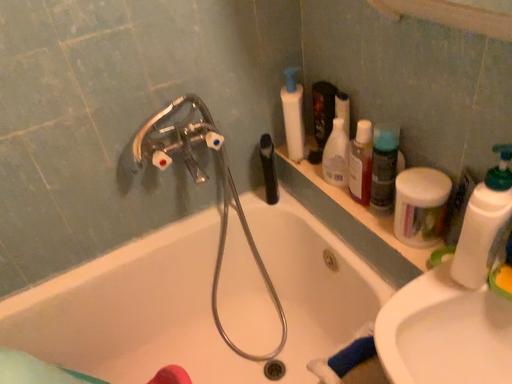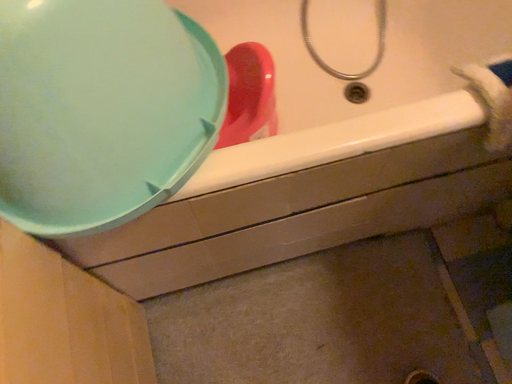
Question: How did the camera likely rotate when shooting the video?

Choices:
 (A) rotated left
 (B) rotated right

Answer: (A)